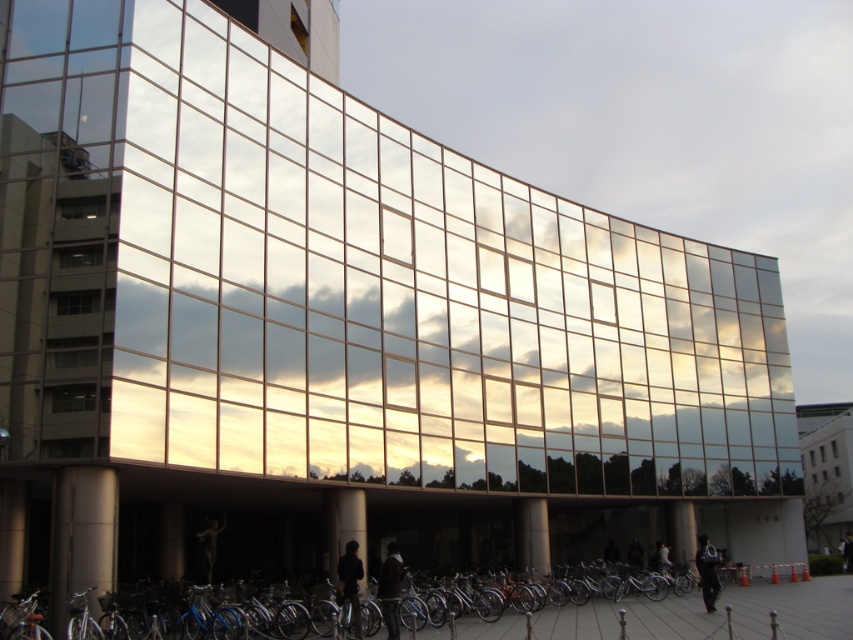
You are standing in front of the modern building with the glass facade. You want to take a photo of a specific point located at coordinates point (409,580). The camera you are using has a minimum focus distance of 30 meters. Will the camera be able to focus on that point?

The distance of point (409,580) from the camera is 40.50 meters, which is beyond the camera minimum focus distance of 30 meters. Therefore, the camera should be able to focus on that point.

You are a photographer trying to capture the reflection of the silver metallic bicycle at lower center and the dark blue fabric jacket at lower right in the building facade. Since the glass reflects objects based on their size, which object will appear larger in the reflection?

The silver metallic bicycle at lower center is bigger than the dark blue fabric jacket at lower right, so it will appear larger in the reflection.

You are a delivery person who needs to load a silver metallic bicycle at lower center and a dark brown leather jacket at lower right into a van. The van has a height restriction of 1.5 meters. Can both items be placed inside without any adjustments?

The silver metallic bicycle at lower center is taller than the dark brown leather jacket at lower right. Since the van has a height restriction of 1.5 meters, we need to know the exact height of the bicycle to determine if it can fit. However, the description only states that the bicycle is taller than the jacket, but does not provide specific measurements. Therefore, it is uncertain whether both items can be placed inside without adjustments.